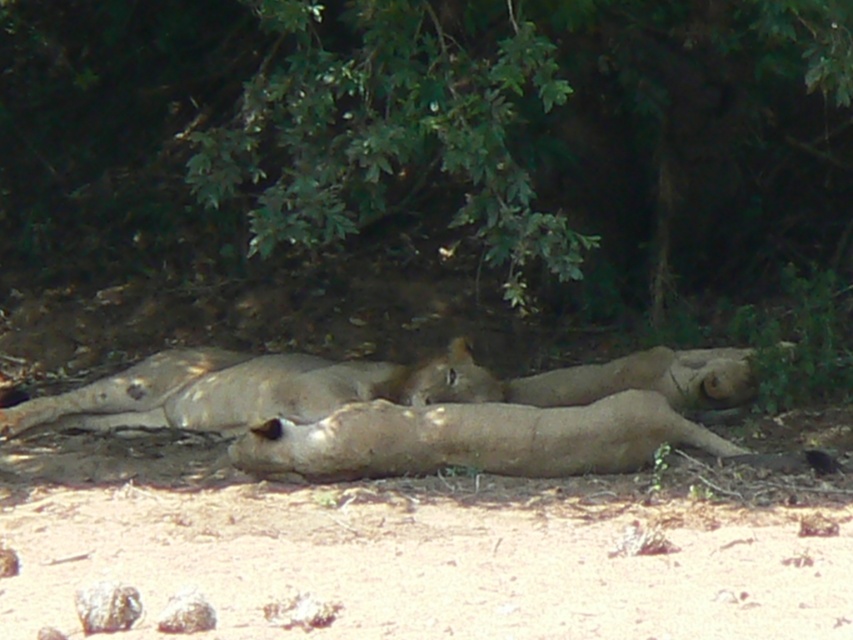
Question: Is green leafy tree at upper center closer to camera compared to light brown fur lion at center?

Choices:
 (A) yes
 (B) no

Answer: (A)

Question: Which point is farther from the camera taking this photo?

Choices:
 (A) (535, 36)
 (B) (85, 406)

Answer: (B)

Question: Considering the relative positions of green leafy tree at upper center and light brown fur at center in the image provided, where is green leafy tree at upper center located with respect to light brown fur at center?

Choices:
 (A) left
 (B) right

Answer: (B)

Question: Is green leafy tree at upper center below light brown fur lion at center?

Choices:
 (A) no
 (B) yes

Answer: (A)

Question: Among these objects, which one is nearest to the camera?

Choices:
 (A) light brown fur at center
 (B) light brown fur lion at center

Answer: (A)

Question: Which object is closer to the camera taking this photo?

Choices:
 (A) green leafy tree at upper center
 (B) light brown fur lion at center
 (C) light brown fur at center

Answer: (A)